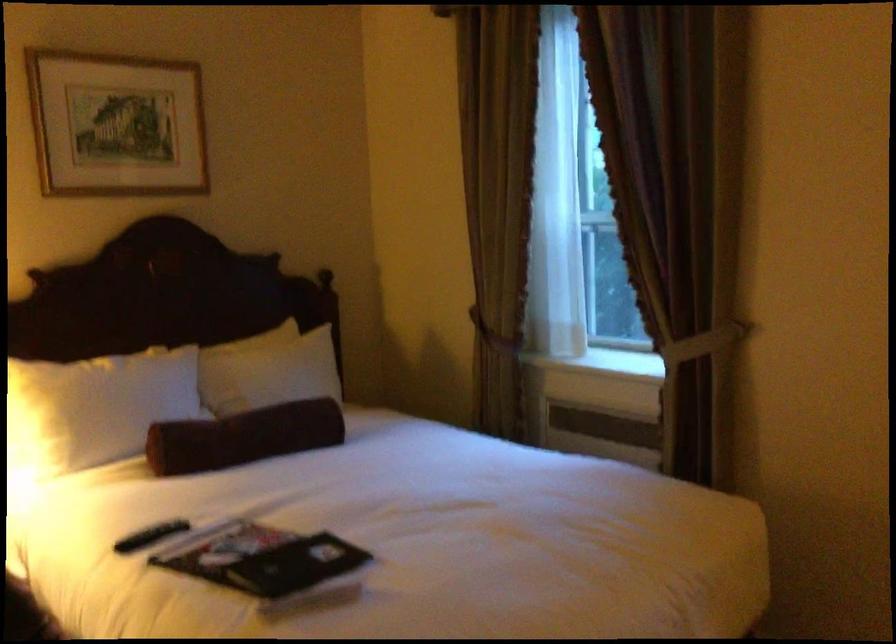
The image size is (896, 644). What are the coordinates of `black remote control` in the screenshot? It's located at (151, 536).